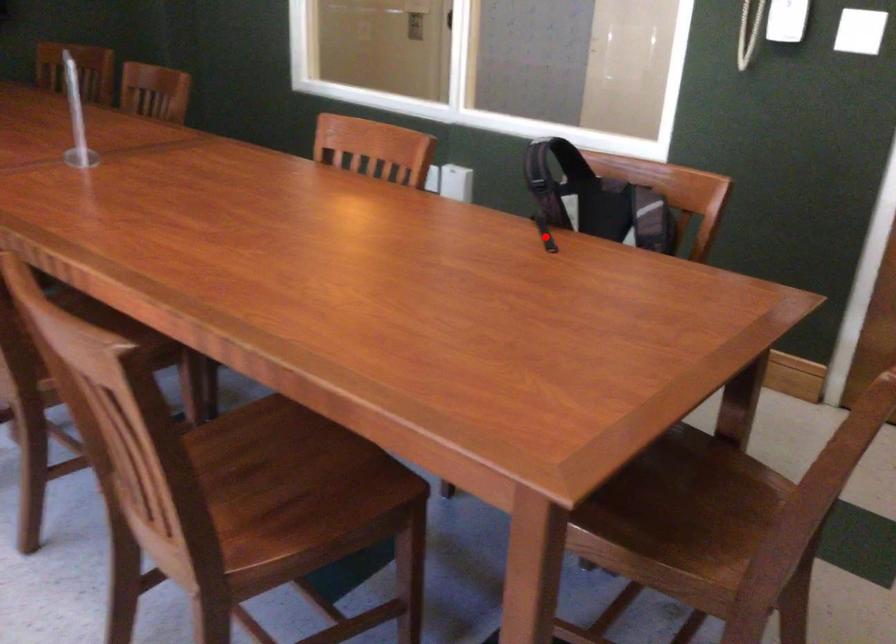
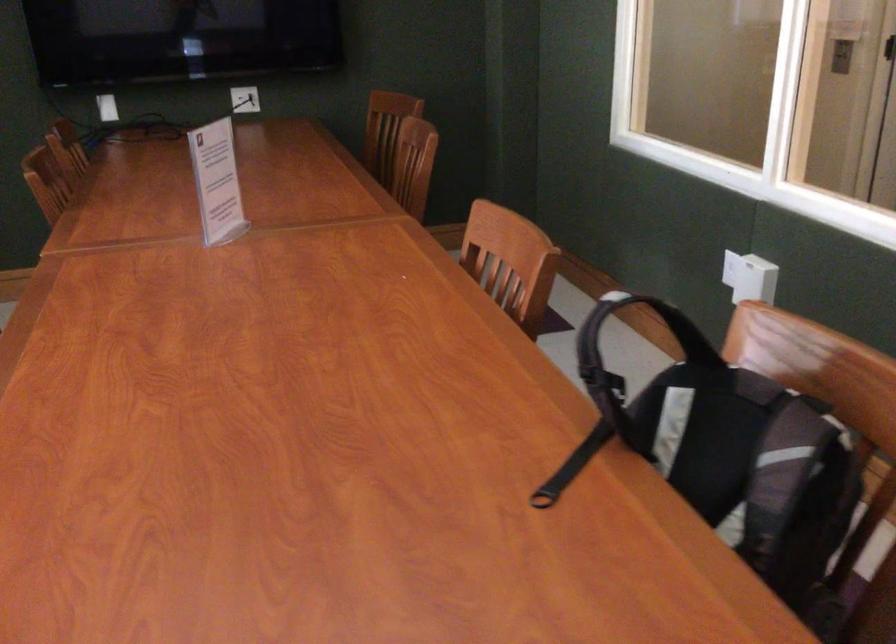
Question: I am providing you with two images of the same scene from different viewpoints. In image1, a red point is highlighted. Considering the same 3D point in image2, which of the following is correct?

Choices:
 (A) It is closer
 (B) It is farther

Answer: (A)